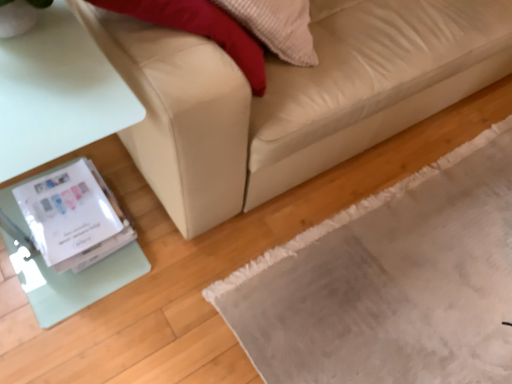
Question: Considering the relative sizes of white glossy wii at lower left and gray textured mat at lower right in the image provided, is white glossy wii at lower left taller than gray textured mat at lower right?

Choices:
 (A) yes
 (B) no

Answer: (A)

Question: Considering the relative positions of white glossy wii at lower left and gray textured mat at lower right in the image provided, is white glossy wii at lower left to the left of gray textured mat at lower right from the viewer's perspective?

Choices:
 (A) no
 (B) yes

Answer: (B)

Question: From the image's perspective, is white glossy wii at lower left below gray textured mat at lower right?

Choices:
 (A) no
 (B) yes

Answer: (A)

Question: Is white glossy wii at lower left facing away from gray textured mat at lower right?

Choices:
 (A) no
 (B) yes

Answer: (A)

Question: Considering the relative positions of white glossy wii at lower left and gray textured mat at lower right in the image provided, is white glossy wii at lower left to the right of gray textured mat at lower right from the viewer's perspective?

Choices:
 (A) yes
 (B) no

Answer: (B)

Question: Is white glossy wii at lower left not inside gray textured mat at lower right?

Choices:
 (A) yes
 (B) no

Answer: (A)

Question: Considering the relative sizes of gray textured mat at lower right and white glossy wii at lower left in the image provided, is gray textured mat at lower right wider than white glossy wii at lower left?

Choices:
 (A) yes
 (B) no

Answer: (A)

Question: From a real-world perspective, does gray textured mat at lower right stand above white glossy wii at lower left?

Choices:
 (A) no
 (B) yes

Answer: (A)

Question: Is there a large distance between gray textured mat at lower right and white glossy wii at lower left?

Choices:
 (A) yes
 (B) no

Answer: (B)

Question: Considering the relative positions of gray textured mat at lower right and white glossy wii at lower left in the image provided, is gray textured mat at lower right behind white glossy wii at lower left?

Choices:
 (A) no
 (B) yes

Answer: (A)

Question: Is gray textured mat at lower right at the left side of white glossy wii at lower left?

Choices:
 (A) yes
 (B) no

Answer: (B)

Question: Can you confirm if gray textured mat at lower right is taller than white glossy wii at lower left?

Choices:
 (A) yes
 (B) no

Answer: (B)

Question: Is white glossy wii at lower left inside beige leather couch at lower left?

Choices:
 (A) yes
 (B) no

Answer: (B)